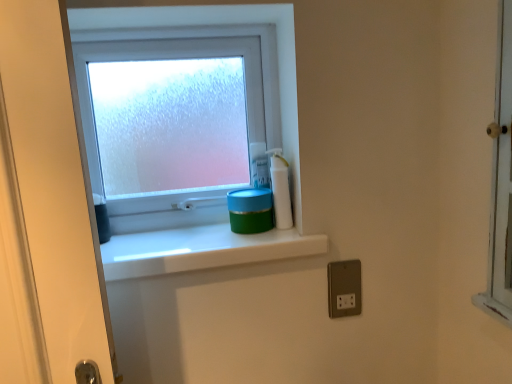
Question: Are white glossy bottle at upper right and blue plastic container at upper right located far from each other?

Choices:
 (A) yes
 (B) no

Answer: (B)

Question: Can you confirm if white glossy bottle at upper right is positioned to the right of blue plastic container at upper right?

Choices:
 (A) no
 (B) yes

Answer: (B)

Question: Considering the relative positions of white glossy bottle at upper right and blue plastic container at upper right in the image provided, is white glossy bottle at upper right to the left of blue plastic container at upper right from the viewer's perspective?

Choices:
 (A) no
 (B) yes

Answer: (A)

Question: Is white glossy bottle at upper right positioned behind blue plastic container at upper right?

Choices:
 (A) no
 (B) yes

Answer: (A)

Question: From the image's perspective, does white glossy bottle at upper right appear lower than blue plastic container at upper right?

Choices:
 (A) yes
 (B) no

Answer: (A)

Question: From the image's perspective, is blue plastic container at upper right above or below green matte container at center?

Choices:
 (A) below
 (B) above

Answer: (B)

Question: Is blue plastic container at upper right bigger or smaller than green matte container at center?

Choices:
 (A) small
 (B) big

Answer: (A)

Question: In terms of width, does blue plastic container at upper right look wider or thinner when compared to green matte container at center?

Choices:
 (A) thin
 (B) wide

Answer: (A)

Question: Is blue plastic container at upper right taller or shorter than green matte container at center?

Choices:
 (A) tall
 (B) short

Answer: (A)

Question: Is satin silver outlet at lower right spatially inside white glossy bottle at upper right, or outside of it?

Choices:
 (A) inside
 (B) outside

Answer: (B)

Question: Does point (351, 284) appear closer or farther from the camera than point (280, 168)?

Choices:
 (A) farther
 (B) closer

Answer: (B)

Question: Is satin silver outlet at lower right taller or shorter than white glossy bottle at upper right?

Choices:
 (A) short
 (B) tall

Answer: (A)

Question: Is satin silver outlet at lower right wider or thinner than white glossy bottle at upper right?

Choices:
 (A) wide
 (B) thin

Answer: (B)

Question: From their relative heights in the image, would you say frosted glass window at upper center is taller or shorter than satin silver outlet at lower right?

Choices:
 (A) tall
 (B) short

Answer: (A)

Question: From a real-world perspective, is frosted glass window at upper center above or below satin silver outlet at lower right?

Choices:
 (A) above
 (B) below

Answer: (A)